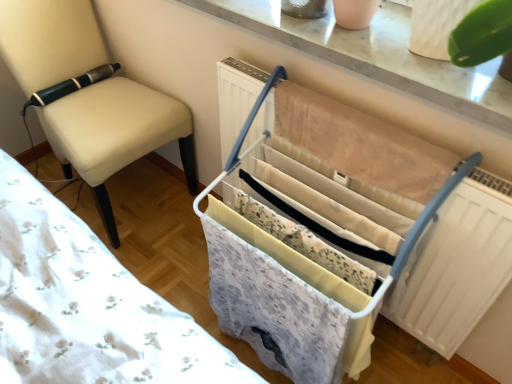
The width and height of the screenshot is (512, 384). I want to click on vacant area on top of white plastic drying rack at center (from a real-world perspective), so click(362, 118).